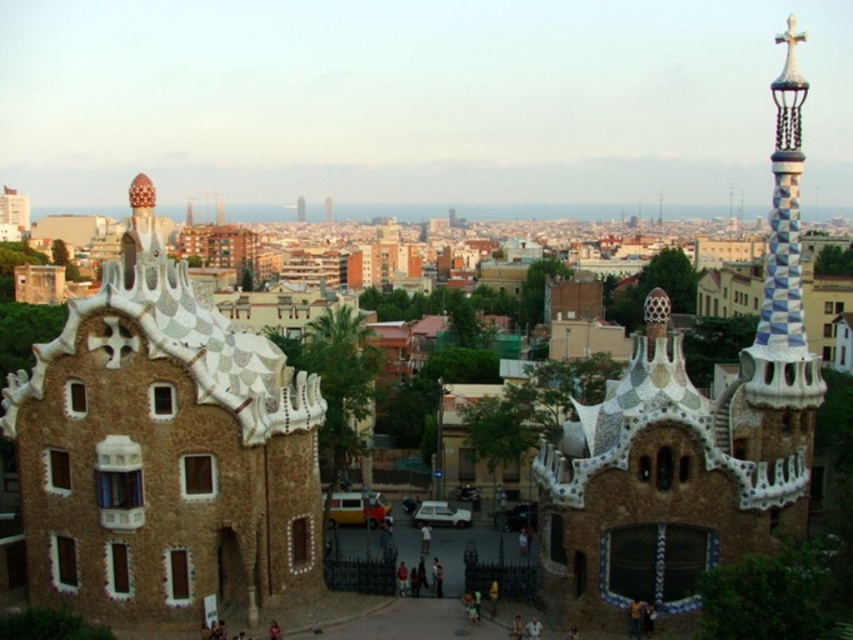
Question: Is brown textured stone tower at center-left bigger than white mosaic tower at upper right?

Choices:
 (A) no
 (B) yes

Answer: (A)

Question: Can you confirm if brown textured stone tower at center-left is positioned to the right of white mosaic tower at upper right?

Choices:
 (A) no
 (B) yes

Answer: (A)

Question: Is brown textured stone tower at center-left further to the viewer compared to white mosaic tower at upper right?

Choices:
 (A) yes
 (B) no

Answer: (A)

Question: Among these points, which one is nearest to the camera?

Choices:
 (A) (775, 433)
 (B) (264, 401)

Answer: (B)

Question: Which object is closer to the camera taking this photo?

Choices:
 (A) white mosaic tower at upper right
 (B) brown textured stone tower at center-left

Answer: (A)